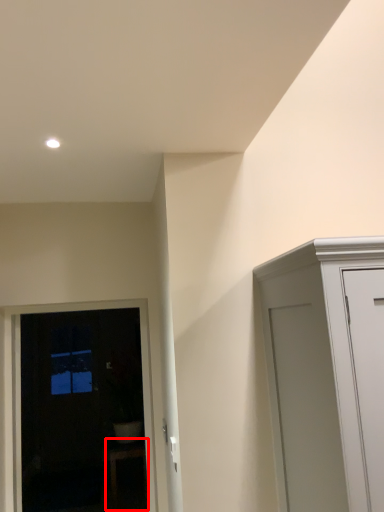
Question: From the image's perspective, what is the correct spatial relationship of furniture (annotated by the red box) in relation to door?

Choices:
 (A) above
 (B) below

Answer: (B)